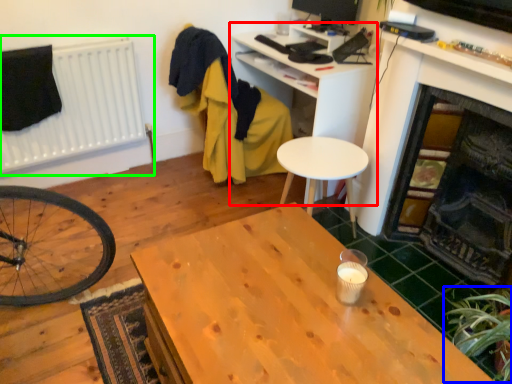
Question: Based on their relative distances, which object is nearer to computer desk (highlighted by a red box)? Choose from plant (highlighted by a blue box) and radiator (highlighted by a green box).

Choices:
 (A) plant
 (B) radiator

Answer: (B)